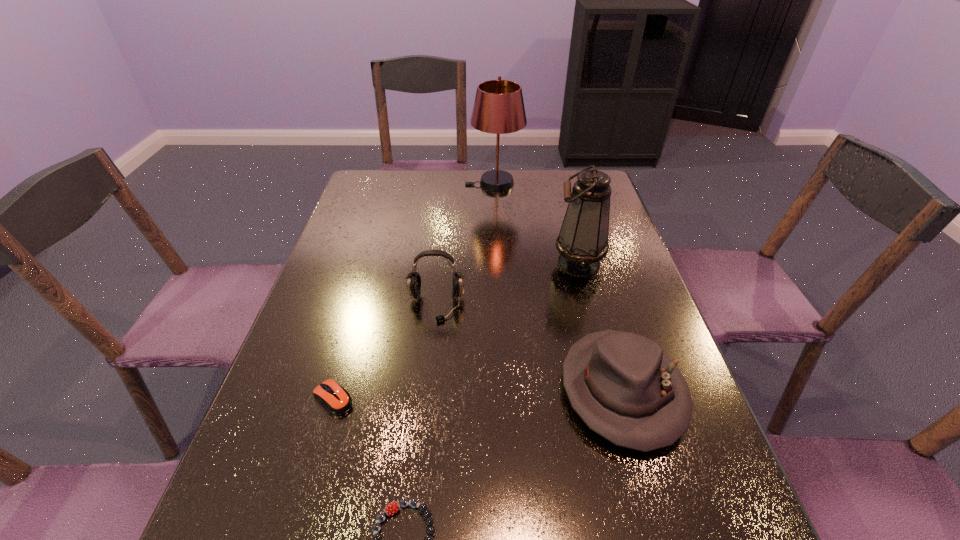
The width and height of the screenshot is (960, 540). In order to click on blank space located on the front-facing side of the lampshade in this screenshot , I will do `click(440, 184)`.

The height and width of the screenshot is (540, 960). I want to click on vacant space located 0.250m on the front-facing side of the lampshade, so click(x=395, y=184).

At what (x,y) coordinates should I click in order to perform the action: click on vacant space located 0.220m on the front of the second farthest object. Please return your answer as a coordinate pair (x, y). Looking at the image, I should click on (601, 349).

Where is `free space located with the microphone on the side of the headset`? The image size is (960, 540). free space located with the microphone on the side of the headset is located at coordinates (427, 391).

Where is `free region located 0.110m on the decorative side of the fourth tallest object`? The width and height of the screenshot is (960, 540). free region located 0.110m on the decorative side of the fourth tallest object is located at coordinates (660, 524).

The width and height of the screenshot is (960, 540). I want to click on vacant area located on the back of the second shortest object, so click(363, 296).

Find the location of a particular element. The width and height of the screenshot is (960, 540). object at the far edge is located at coordinates (498, 108).

Where is `object at the left edge`? This screenshot has width=960, height=540. object at the left edge is located at coordinates 335,398.

Where is `oil lamp at the right edge`? This screenshot has height=540, width=960. oil lamp at the right edge is located at coordinates (583, 239).

Identify the location of hat positioned at the right edge. (624, 387).